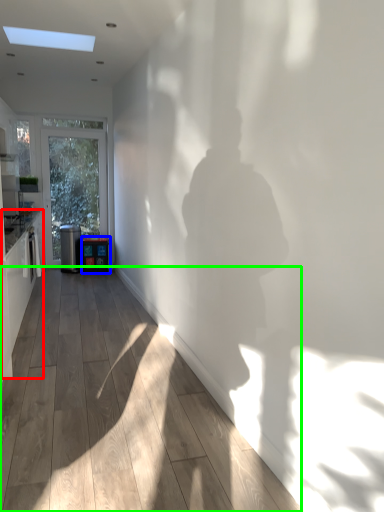
Question: Based on their relative distances, which object is nearer to cabinetry (highlighted by a red box)? Choose from appliance (highlighted by a blue box) and corridor (highlighted by a green box).

Choices:
 (A) appliance
 (B) corridor

Answer: (B)